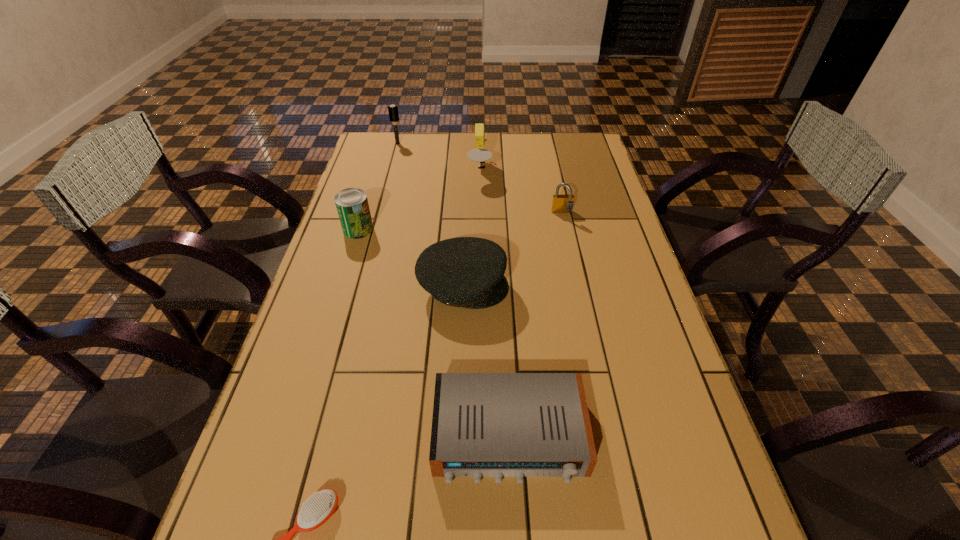
The height and width of the screenshot is (540, 960). What are the coordinates of `vacant space located 0.220m on the front-facing side of the sponge` in the screenshot? It's located at (551, 170).

You are a GUI agent. You are given a task and a screenshot of the screen. Output one action in this format:
    pyautogui.click(x=<x>, y=<y>)
    Task: Click on the vacant space located on the back of the fourth nearest object
    The height and width of the screenshot is (540, 960).
    Given the screenshot: What is the action you would take?
    pyautogui.click(x=366, y=203)

Identify the location of vacant space located on the side with the combination dials of the third farthest object. (566, 233).

Find the location of a particular element. vacant space located on the front-facing side of the fifth farthest object is located at coordinates (622, 287).

Locate an element on the screen. vacant space situated on the control panel of the second nearest object is located at coordinates (514, 532).

I want to click on hairbrush positioned at the far edge, so click(x=393, y=112).

This screenshot has width=960, height=540. Find the location of `sponge present at the far edge`. sponge present at the far edge is located at coordinates (479, 154).

The image size is (960, 540). I want to click on hairbrush that is at the left edge, so click(x=393, y=112).

Where is `can at the left edge`? can at the left edge is located at coordinates (352, 205).

Locate an element on the screen. This screenshot has width=960, height=540. object that is at the right edge is located at coordinates (563, 203).